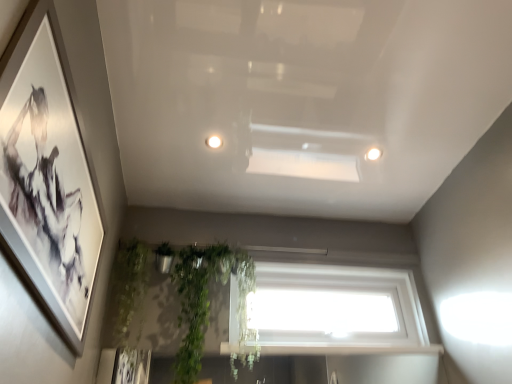
Where is `transparent glass window at center`? transparent glass window at center is located at coordinates (336, 310).

Identify the location of green leafy plant at lower left. The height and width of the screenshot is (384, 512). (128, 286).

The image size is (512, 384). I want to click on matte black picture frame at left, so click(64, 173).

This screenshot has width=512, height=384. Find the location of `white glossy window sill at lower center`. white glossy window sill at lower center is located at coordinates (350, 349).

Is green leafy plant at lower left wider than white glossy light fixture at center, positioned as the second lighting in back-to-front order?

Yes.

Does green leafy plant at lower left turn towards white glossy light fixture at center, the first lighting in the front-to-back sequence?

No.

How different are the orientations of green leafy plant at lower left and white glossy light fixture at center, the first lighting positioned from the top, in degrees?

The angular difference between green leafy plant at lower left and white glossy light fixture at center, the first lighting positioned from the top, is 89.4 degrees.

From a real-world perspective, is green leafy plant at lower left located higher than white glossy light fixture at center, which is the 1th lighting from left to right?

No, from a real-world perspective, green leafy plant at lower left is not over white glossy light fixture at center, which is the 1th lighting from left to right

How many degrees apart are the facing directions of white glossy light fixture at center, the second lighting from the right, and green leafy plant at lower left?

The angular difference between white glossy light fixture at center, the second lighting from the right, and green leafy plant at lower left is 89.4 degrees.

Between white glossy light fixture at center, which ranks as the 2th lighting in bottom-to-top order, and green leafy plant at lower left, which one has larger width?

green leafy plant at lower left is wider.

Is point (210, 138) less distant than point (144, 260)?

Yes, point (210, 138) is closer to viewer.

Where is `window sill located in front of the white glossy light fixture at upper right, the 1th lighting from the right`? The image size is (512, 384). window sill located in front of the white glossy light fixture at upper right, the 1th lighting from the right is located at coordinates (350, 349).

Is there a large distance between white glossy light fixture at upper right, which appears as the second lighting when viewed from the front, and white glossy window sill at lower center?

white glossy light fixture at upper right, which appears as the second lighting when viewed from the front, is actually quite close to white glossy window sill at lower center.

Would you say white glossy window sill at lower center is a long distance from transparent glass window at center?

No.

Which point is more distant from viewer, (276, 353) or (277, 280)?

The point (277, 280) is farther from the camera.

Is transparent glass window at center at the back of white glossy window sill at lower center?

No.

Which of these two, white glossy window sill at lower center or transparent glass window at center, is wider?

Wider between the two is transparent glass window at center.

From the image's perspective, who appears lower, transparent glass window at center or white glossy window sill at lower center?

white glossy window sill at lower center.

From a real-world perspective, which is physically above, transparent glass window at center or white glossy window sill at lower center?

In real-world perspective, transparent glass window at center is above.

Who is smaller, transparent glass window at center or white glossy window sill at lower center?

Smaller between the two is white glossy window sill at lower center.

Consider the image. From a real-world perspective, does transparent glass window at center stand above green leafy plant at lower left?

Yes, from a real-world perspective, transparent glass window at center is on top of green leafy plant at lower left.

Is transparent glass window at center to the right of green leafy plant at lower left from the viewer's perspective?

Yes, transparent glass window at center is to the right of green leafy plant at lower left.

Is transparent glass window at center looking in the opposite direction of green leafy plant at lower left?

No, transparent glass window at center is not facing the opposite direction of green leafy plant at lower left.

Is transparent glass window at center closer to camera compared to green leafy plant at lower left?

No, transparent glass window at center is behind green leafy plant at lower left.

Does transparent glass window at center have a greater width compared to white glossy light fixture at center, which is the 1th lighting from left to right?

Correct, the width of transparent glass window at center exceeds that of white glossy light fixture at center, which is the 1th lighting from left to right.

Locate an element on the screen. The width and height of the screenshot is (512, 384). window below the white glossy light fixture at center, the first lighting positioned from the top (from a real-world perspective) is located at coordinates (336, 310).

Considering the sizes of objects transparent glass window at center and white glossy light fixture at center, the second lighting from the right, in the image provided, who is taller, transparent glass window at center or white glossy light fixture at center, the second lighting from the right,?

Standing taller between the two is transparent glass window at center.

From the picture: Is transparent glass window at center oriented away from white glossy light fixture at center, the first lighting in the front-to-back sequence?

No, transparent glass window at center is not facing the opposite direction of white glossy light fixture at center, the first lighting in the front-to-back sequence.

There is a green leafy plant at lower left. What are the coordinates of `the 2nd lighting above it (from the image's perspective)` in the screenshot? It's located at (214, 141).

The height and width of the screenshot is (384, 512). In order to click on plant below the white glossy light fixture at center, which ranks as the 2th lighting in bottom-to-top order (from the image's perspective) in this screenshot , I will do `click(128, 286)`.

Estimate the real-world distances between objects in this image. Which object is closer to green leafy plant at lower left, transparent glass window at center or white glossy light fixture at center, positioned as the second lighting in back-to-front order?

white glossy light fixture at center, positioned as the second lighting in back-to-front order, lies closer to green leafy plant at lower left than the other object.

Based on their spatial positions, is white glossy light fixture at upper right, the first lighting from the bottom, or green leafy plant at lower left closer to white glossy light fixture at center, the first lighting positioned from the top?

Based on the image, white glossy light fixture at upper right, the first lighting from the bottom, appears to be nearer to white glossy light fixture at center, the first lighting positioned from the top.

Based on their spatial positions, is white glossy window sill at lower center or matte black picture frame at left further from white glossy light fixture at upper right, which appears as the second lighting when viewed from the left?

matte black picture frame at left.

Which object lies further to the anchor point white glossy window sill at lower center, white glossy light fixture at center, which ranks as the 2th lighting in bottom-to-top order, or green leafy plant at lower left?

Among the two, white glossy light fixture at center, which ranks as the 2th lighting in bottom-to-top order, is located further to white glossy window sill at lower center.

Which object lies nearer to the anchor point white glossy light fixture at center, positioned as the second lighting in back-to-front order, green leafy plant at lower left or white glossy window sill at lower center?

green leafy plant at lower left lies closer to white glossy light fixture at center, positioned as the second lighting in back-to-front order, than the other object.

Which object lies nearer to the anchor point transparent glass window at center, white glossy window sill at lower center or white glossy light fixture at upper right, the 1th lighting from the right?

Among the two, white glossy window sill at lower center is located nearer to transparent glass window at center.

Considering their positions, is matte black picture frame at left positioned further to transparent glass window at center than white glossy light fixture at upper right, which appears as the second lighting when viewed from the front?

Among the two, matte black picture frame at left is located further to transparent glass window at center.

Based on the photo, estimate the real-world distances between objects in this image. Which object is further from transparent glass window at center, matte black picture frame at left or green leafy plant at lower left?

Among the two, matte black picture frame at left is located further to transparent glass window at center.

The width and height of the screenshot is (512, 384). Find the location of `lighting between white glossy light fixture at center, which is the 1th lighting from left to right, and white glossy window sill at lower center in the up-down direction`. lighting between white glossy light fixture at center, which is the 1th lighting from left to right, and white glossy window sill at lower center in the up-down direction is located at coordinates click(373, 154).

This screenshot has height=384, width=512. In order to click on plant between white glossy light fixture at center, the first lighting positioned from the top, and white glossy window sill at lower center from top to bottom in this screenshot , I will do `click(128, 286)`.

Identify the location of window between white glossy light fixture at center, positioned as the second lighting in back-to-front order, and white glossy window sill at lower center, in the vertical direction. tap(336, 310).

Locate an element on the screen. window situated between green leafy plant at lower left and white glossy window sill at lower center from left to right is located at coordinates (336, 310).